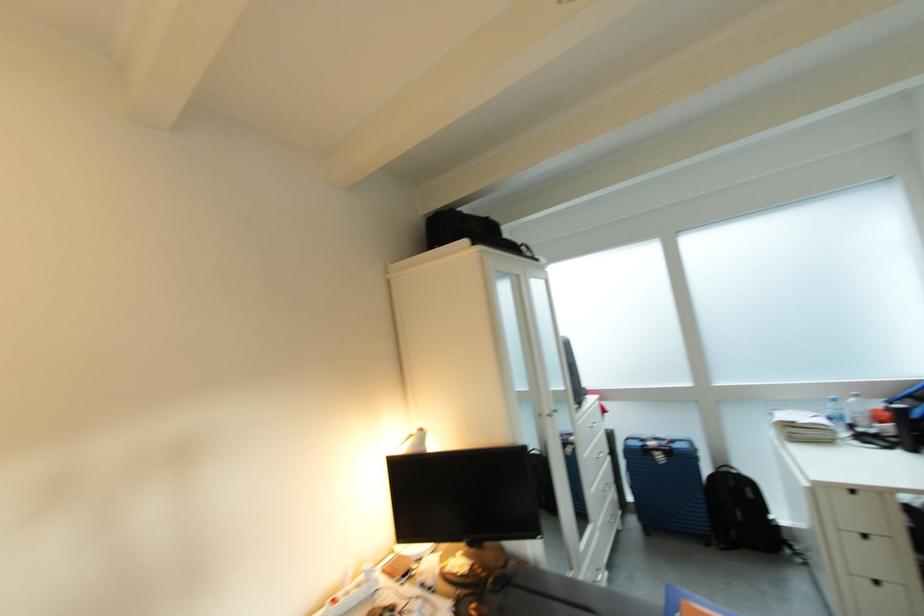
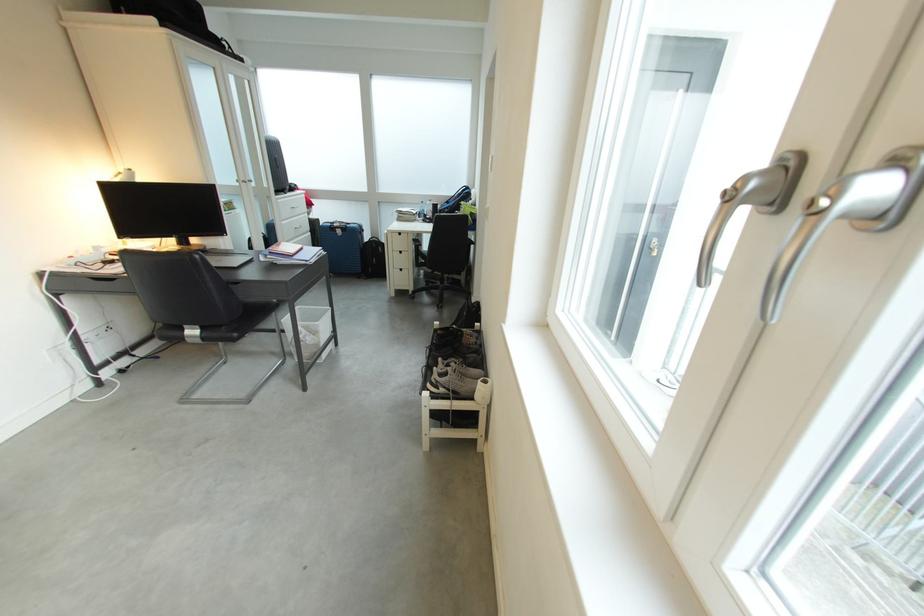
Locate, in the second image, the point that corresponds to point 671,460 in the first image.

(350, 235)